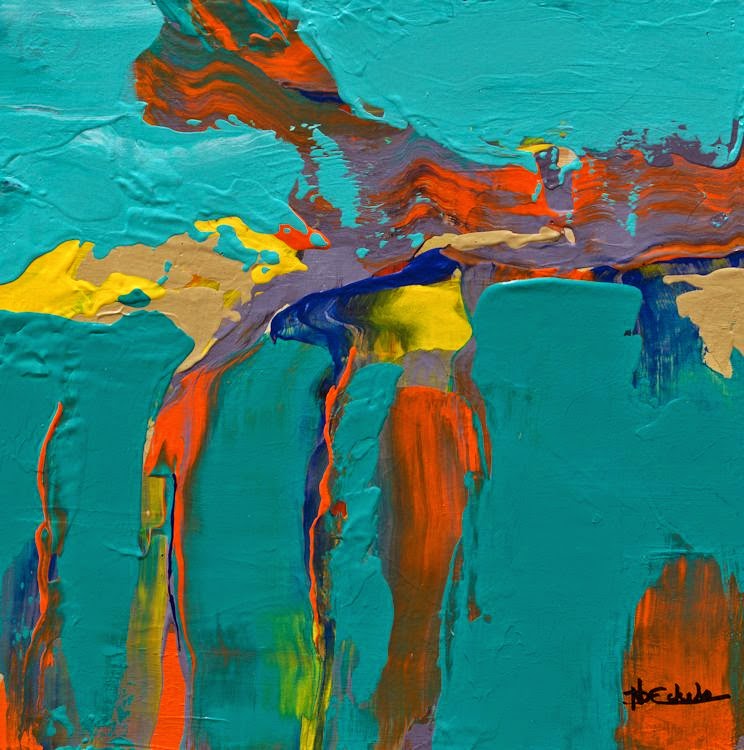
The image size is (744, 750). What are the coordinates of `green paint` in the screenshot? It's located at (283, 688).